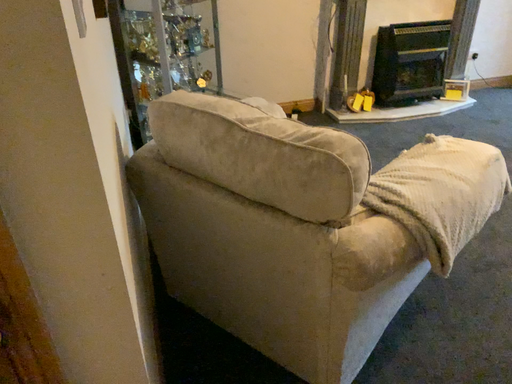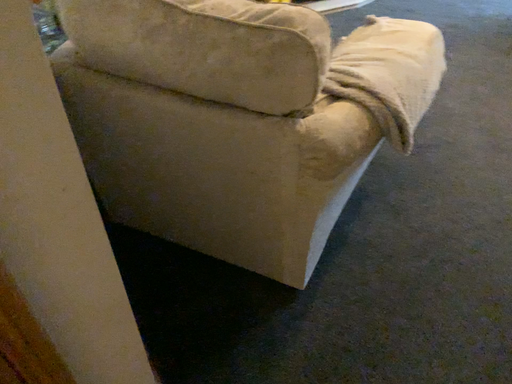
Question: Which way did the camera rotate in the video?

Choices:
 (A) rotated downward
 (B) rotated upward

Answer: (A)